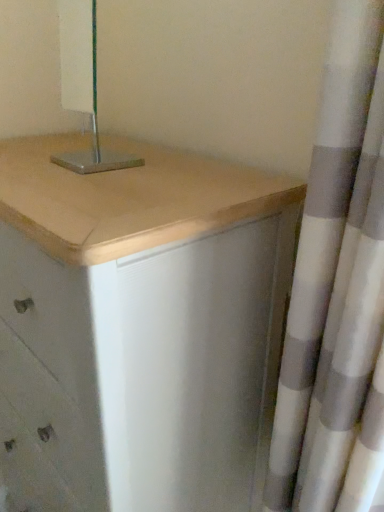
Where is `metallic silver lamp at upper center`? This screenshot has width=384, height=512. metallic silver lamp at upper center is located at coordinates (84, 86).

Locate an element on the screen. This screenshot has width=384, height=512. white textured curtain at right is located at coordinates (337, 291).

What is the approximate height of matte white chest of drawers at center?

matte white chest of drawers at center is 4.21 feet in height.

This screenshot has width=384, height=512. What are the coordinates of `metallic silver lamp at upper center` in the screenshot? It's located at (84, 86).

Is matte white chest of drawers at center facing towards metallic silver lamp at upper center?

No, matte white chest of drawers at center is not turned towards metallic silver lamp at upper center.

Consider the image. Considering the relative sizes of matte white chest of drawers at center and metallic silver lamp at upper center in the image provided, is matte white chest of drawers at center shorter than metallic silver lamp at upper center?

No.

Is matte white chest of drawers at center situated inside metallic silver lamp at upper center or outside?

matte white chest of drawers at center is spatially situated outside metallic silver lamp at upper center.

Is the surface of matte white chest of drawers at center in direct contact with metallic silver lamp at upper center?

No, matte white chest of drawers at center is not next to metallic silver lamp at upper center.

Is white textured curtain at right in front of matte white chest of drawers at center?

That is True.

Is matte white chest of drawers at center inside white textured curtain at right?

No, matte white chest of drawers at center is not a part of white textured curtain at right.

Is white textured curtain at right facing towards matte white chest of drawers at center?

No, white textured curtain at right is not aimed at matte white chest of drawers at center.

Is point (64, 153) positioned in front of point (136, 382)?

No, (64, 153) is further to viewer.

From the image's perspective, which is above, metallic silver lamp at upper center or matte white chest of drawers at center?

metallic silver lamp at upper center, from the image's perspective.

Identify the location of bedside lamp on the right of matte white chest of drawers at center. The image size is (384, 512). (84, 86).

How many degrees apart are the facing directions of metallic silver lamp at upper center and white textured curtain at right?

The angular difference between metallic silver lamp at upper center and white textured curtain at right is 0.0106 degrees.

From the image's perspective, who appears lower, metallic silver lamp at upper center or white textured curtain at right?

white textured curtain at right appears lower in the image.

From a real-world perspective, is metallic silver lamp at upper center below white textured curtain at right?

No, from a real-world perspective, metallic silver lamp at upper center is not below white textured curtain at right.

Consider the image. How far apart are metallic silver lamp at upper center and white textured curtain at right?

They are 35.39 inches apart.

From the image's perspective, is matte white chest of drawers at center under white textured curtain at right?

Yes, from the image's perspective, matte white chest of drawers at center is beneath white textured curtain at right.

Is matte white chest of drawers at center located outside white textured curtain at right?

Yes, matte white chest of drawers at center is outside of white textured curtain at right.

Is matte white chest of drawers at center placed right next to white textured curtain at right?

No, matte white chest of drawers at center is not touching white textured curtain at right.

Who is taller, white textured curtain at right or metallic silver lamp at upper center?

With more height is white textured curtain at right.

From a real-world perspective, is white textured curtain at right located higher than metallic silver lamp at upper center?

Actually, white textured curtain at right is physically below metallic silver lamp at upper center in the real world.

Is white textured curtain at right in front of or behind metallic silver lamp at upper center in the image?

white textured curtain at right is positioned closer to the viewer than metallic silver lamp at upper center.

Could you tell me if white textured curtain at right is facing metallic silver lamp at upper center?

No, white textured curtain at right is not turned towards metallic silver lamp at upper center.

Find the location of `bedside lamp located above the matte white chest of drawers at center (from the image's perspective)`. bedside lamp located above the matte white chest of drawers at center (from the image's perspective) is located at coordinates (84, 86).

Locate an element on the screen. This screenshot has width=384, height=512. curtain that is in front of the matte white chest of drawers at center is located at coordinates (337, 291).

Estimate the real-world distances between objects in this image. Which object is closer to metallic silver lamp at upper center, matte white chest of drawers at center or white textured curtain at right?

Among the two, matte white chest of drawers at center is located nearer to metallic silver lamp at upper center.

Based on their spatial positions, is matte white chest of drawers at center or metallic silver lamp at upper center closer to white textured curtain at right?

matte white chest of drawers at center lies closer to white textured curtain at right than the other object.

Based on their spatial positions, is white textured curtain at right or matte white chest of drawers at center further from metallic silver lamp at upper center?

white textured curtain at right is positioned further to the anchor metallic silver lamp at upper center.

Looking at the image, which one is located further to white textured curtain at right, metallic silver lamp at upper center or matte white chest of drawers at center?

metallic silver lamp at upper center.

When comparing their distances from matte white chest of drawers at center, does metallic silver lamp at upper center or white textured curtain at right seem further?

Based on the image, metallic silver lamp at upper center appears to be further to matte white chest of drawers at center.

Estimate the real-world distances between objects in this image. Which object is further from matte white chest of drawers at center, white textured curtain at right or metallic silver lamp at upper center?

metallic silver lamp at upper center is positioned further to the anchor matte white chest of drawers at center.

Where is `curtain between metallic silver lamp at upper center and matte white chest of drawers at center from top to bottom`? Image resolution: width=384 pixels, height=512 pixels. curtain between metallic silver lamp at upper center and matte white chest of drawers at center from top to bottom is located at coordinates (337, 291).